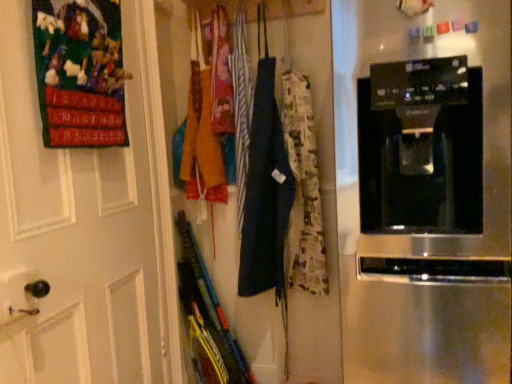
Image resolution: width=512 pixels, height=384 pixels. I want to click on white matte door at upper left, so click(85, 225).

Image resolution: width=512 pixels, height=384 pixels. Identify the location of printed fabric apron at center. (221, 76).

Visually, is printed fabric apron at center positioned to the left or to the right of dark blue fabric apron at center?

printed fabric apron at center is positioned on dark blue fabric apron at center's left side.

Are printed fabric apron at center and dark blue fabric apron at center located far from each other?

No, printed fabric apron at center is not far from dark blue fabric apron at center.

From a real-world perspective, is printed fabric apron at center physically located above or below dark blue fabric apron at center?

In terms of real-world spatial position, printed fabric apron at center is above dark blue fabric apron at center.

In the image, is black glossy coffee maker at center on the left side or the right side of dark blue fabric apron at center?

black glossy coffee maker at center is positioned on dark blue fabric apron at center's right side.

Which is nearer, (452, 284) or (323, 377)?

Point (452, 284).

What are the coordinates of `closet located on the left of black glossy coffee maker at center` in the screenshot? It's located at [323, 221].

Considering the relative positions of white matte door at upper left and dark blue fabric apron at center in the image provided, is white matte door at upper left to the left of dark blue fabric apron at center from the viewer's perspective?

Indeed, white matte door at upper left is positioned on the left side of dark blue fabric apron at center.

The height and width of the screenshot is (384, 512). I want to click on closet on the right side of white matte door at upper left, so click(x=323, y=221).

Is white matte door at upper left beside dark blue fabric apron at center?

white matte door at upper left is not next to dark blue fabric apron at center, and they're not touching.

In the image, is white matte door at upper left positioned in front of or behind black glossy coffee maker at center?

In the image, white matte door at upper left appears behind black glossy coffee maker at center.

From the image's perspective, who appears lower, white matte door at upper left or black glossy coffee maker at center?

white matte door at upper left.

From a real-world perspective, is white matte door at upper left above or below black glossy coffee maker at center?

white matte door at upper left is situated higher than black glossy coffee maker at center in the real world.

Which of these two, white matte door at upper left or black glossy coffee maker at center, is smaller?

white matte door at upper left.

From the image's perspective, is printed fabric apron at center on white matte door at upper left?

Correct, printed fabric apron at center appears higher than white matte door at upper left in the image.

Between printed fabric apron at center and white matte door at upper left, which one has smaller width?

white matte door at upper left.

Is the position of printed fabric apron at center more distant than that of white matte door at upper left?

That is True.

Could white matte door at upper left be considered to be inside printed fabric apron at center?

No, printed fabric apron at center does not contain white matte door at upper left.

Is white matte door at upper left spatially inside printed fabric apron at center, or outside of it?

white matte door at upper left is located beyond the bounds of printed fabric apron at center.

Does white matte door at upper left have a larger size compared to printed fabric apron at center?

Yes, white matte door at upper left is bigger than printed fabric apron at center.

From the image's perspective, relative to printed fabric apron at center, is white matte door at upper left above or below?

Based on their image positions, white matte door at upper left is located beneath printed fabric apron at center.

Locate an element on the screen. The height and width of the screenshot is (384, 512). clothing that appears on the right of white matte door at upper left is located at coordinates (221, 76).

From a real-world perspective, who is located lower, dark blue fabric apron at center or printed fabric apron at center?

dark blue fabric apron at center.

Is point (334, 314) positioned before point (227, 69)?

Yes, point (334, 314) is closer to viewer.

Which of these two, dark blue fabric apron at center or printed fabric apron at center, is smaller?

With smaller size is printed fabric apron at center.

Who is taller, dark blue fabric apron at center or printed fabric apron at center?

Standing taller between the two is dark blue fabric apron at center.

You are a GUI agent. You are given a task and a screenshot of the screen. Output one action in this format:
    pyautogui.click(x=<x>, y=<y>)
    Task: Click on the closet on the right of printed fabric apron at center
    Image resolution: width=512 pixels, height=384 pixels.
    Given the screenshot: What is the action you would take?
    pyautogui.click(x=323, y=221)

Locate an element on the screen. home appliance below the dark blue fabric apron at center (from the image's perspective) is located at coordinates (424, 189).

Which object lies further to the anchor point printed fabric apron at center, white matte door at upper left or dark blue fabric apron at center?

Based on the image, white matte door at upper left appears to be further to printed fabric apron at center.

Estimate the real-world distances between objects in this image. Which object is closer to dark blue fabric apron at center, white matte door at upper left or black glossy coffee maker at center?

The object closer to dark blue fabric apron at center is white matte door at upper left.

From the picture: Considering their positions, is printed fabric apron at center positioned closer to dark blue fabric apron at center than white matte door at upper left?

printed fabric apron at center.

Estimate the real-world distances between objects in this image. Which object is further from black glossy coffee maker at center, dark blue fabric apron at center or printed fabric apron at center?

printed fabric apron at center.

When comparing their distances from printed fabric apron at center, does black glossy coffee maker at center or white matte door at upper left seem further?

The object further to printed fabric apron at center is black glossy coffee maker at center.

Based on their spatial positions, is black glossy coffee maker at center or dark blue fabric apron at center closer to white matte door at upper left?

dark blue fabric apron at center is positioned closer to the anchor white matte door at upper left.

Which object lies nearer to the anchor point dark blue fabric apron at center, black glossy coffee maker at center or white matte door at upper left?

white matte door at upper left lies closer to dark blue fabric apron at center than the other object.

Estimate the real-world distances between objects in this image. Which object is further from white matte door at upper left, black glossy coffee maker at center or printed fabric apron at center?

The object further to white matte door at upper left is black glossy coffee maker at center.

The width and height of the screenshot is (512, 384). Identify the location of closet located between white matte door at upper left and black glossy coffee maker at center in the left-right direction. (323, 221).

At what (x,y) coordinates should I click in order to perform the action: click on closet between white matte door at upper left and printed fabric apron at center from front to back. Please return your answer as a coordinate pair (x, y). This screenshot has height=384, width=512. Looking at the image, I should click on (323, 221).

You are a GUI agent. You are given a task and a screenshot of the screen. Output one action in this format:
    pyautogui.click(x=<x>, y=<y>)
    Task: Click on the closet positioned between black glossy coffee maker at center and printed fabric apron at center from near to far
    
    Given the screenshot: What is the action you would take?
    pyautogui.click(x=323, y=221)

I want to click on clothing between white matte door at upper left and black glossy coffee maker at center from left to right, so click(221, 76).